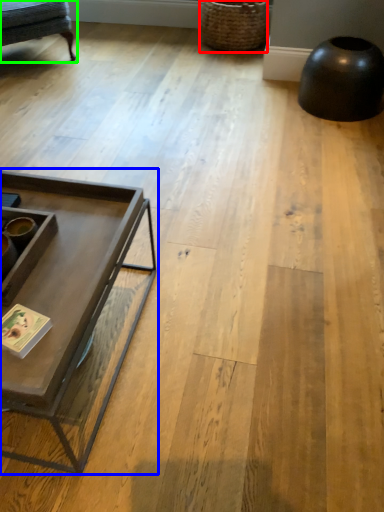
Question: Estimate the real-world distances between objects in this image. Which object is closer to basket (highlighted by a red box), coffee table (highlighted by a blue box) or swivel chair (highlighted by a green box)?

Choices:
 (A) coffee table
 (B) swivel chair

Answer: (B)